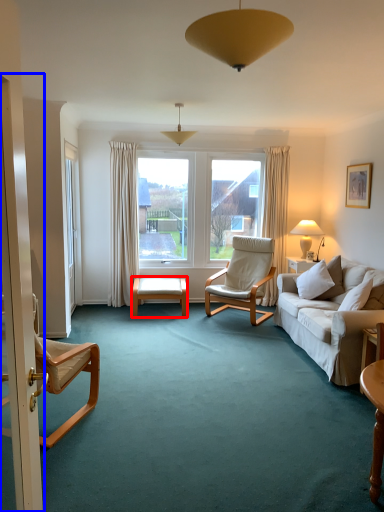
Question: Which object appears closest to the camera in this image, table (highlighted by a red box) or screen door (highlighted by a blue box)?

Choices:
 (A) table
 (B) screen door

Answer: (B)